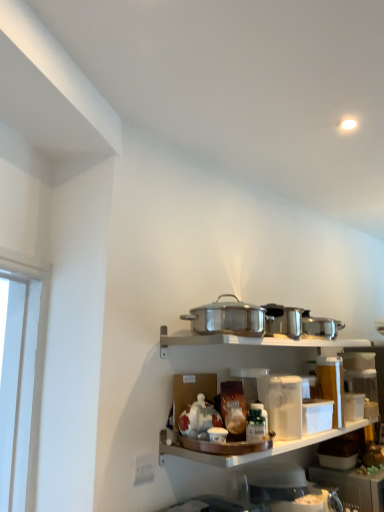
Based on the photo, what is the approximate height of white matte container at center?

white matte container at center is 2.33 inches tall.

Locate an element on the screen. white matte container at center is located at coordinates (246, 452).

You are a GUI agent. You are given a task and a screenshot of the screen. Output one action in this format:
    pyautogui.click(x=<x>, y=<y>)
    Task: Click on the 2nd appliance behind when counting from the white matte container at center
    
    Given the screenshot: What is the action you would take?
    pyautogui.click(x=353, y=487)

Is white plastic container at lower right, placed as the 1th appliance when sorted from back to front, oriented away from white matte container at center?

white plastic container at lower right, placed as the 1th appliance when sorted from back to front, does not have its back to white matte container at center.

Considering the relative sizes of white plastic container at lower right, which is the 1th appliance from bottom to top, and white matte container at center in the image provided, is white plastic container at lower right, which is the 1th appliance from bottom to top, thinner than white matte container at center?

Incorrect, the width of white plastic container at lower right, which is the 1th appliance from bottom to top, is not less than that of white matte container at center.

Is there a large distance between white plastic container at lower right, placed as the 1th appliance when sorted from back to front, and stainless steel pot at center, the first appliance from the top?

No, white plastic container at lower right, placed as the 1th appliance when sorted from back to front, is in close proximity to stainless steel pot at center, the first appliance from the top.

From the image's perspective, is white plastic container at lower right, positioned as the 1th appliance in right-to-left order, located above stainless steel pot at center, positioned as the second appliance in bottom-to-top order?

No, from the image's perspective, white plastic container at lower right, positioned as the 1th appliance in right-to-left order, is not over stainless steel pot at center, positioned as the second appliance in bottom-to-top order.

Who is taller, white plastic container at lower right, which appears as the second appliance when viewed from the top, or stainless steel pot at center, arranged as the first appliance when viewed from the left?

white plastic container at lower right, which appears as the second appliance when viewed from the top, is taller.

Which object is more forward, stainless steel pot at center, positioned as the second appliance in bottom-to-top order, or white plastic container at lower right, placed as the 1th appliance when sorted from back to front?

Positioned in front is stainless steel pot at center, positioned as the second appliance in bottom-to-top order.

Considering the sizes of stainless steel pot at center, the first appliance from the top, and white plastic container at lower right, placed as the 1th appliance when sorted from back to front, in the image, is stainless steel pot at center, the first appliance from the top, bigger or smaller than white plastic container at lower right, placed as the 1th appliance when sorted from back to front,?

stainless steel pot at center, the first appliance from the top, is smaller than white plastic container at lower right, placed as the 1th appliance when sorted from back to front.

Does stainless steel pot at center, arranged as the first appliance when viewed from the left, touch white plastic container at lower right, which is the 1th appliance from bottom to top?

stainless steel pot at center, arranged as the first appliance when viewed from the left, and white plastic container at lower right, which is the 1th appliance from bottom to top, are clearly separated.

Considering the sizes of objects white matte container at center and stainless steel pot at center, arranged as the first appliance when viewed from the left, in the image provided, who is thinner, white matte container at center or stainless steel pot at center, arranged as the first appliance when viewed from the left,?

With smaller width is stainless steel pot at center, arranged as the first appliance when viewed from the left.

How different are the orientations of white matte container at center and stainless steel pot at center, arranged as the second appliance when viewed from the back, in degrees?

There is a 0.435-degree angle between the facing directions of white matte container at center and stainless steel pot at center, arranged as the second appliance when viewed from the back.

Considering the positions of point (282, 449) and point (247, 309), is point (282, 449) closer or farther from the camera than point (247, 309)?

Point (282, 449) is positioned closer to the camera compared to point (247, 309).

Relative to stainless steel pot at center, the second appliance viewed from the right, is white matte container at center in front or behind?

Clearly, white matte container at center is in front of stainless steel pot at center, the second appliance viewed from the right.

This screenshot has width=384, height=512. I want to click on the 1st appliance behind the white matte container at center, so click(x=228, y=318).

Measure the distance from stainless steel pot at center, the first appliance from the top, to white matte container at center.

stainless steel pot at center, the first appliance from the top, and white matte container at center are 43.36 centimeters apart from each other.

Is point (207, 334) positioned behind point (179, 441)?

That is False.

Can you confirm if white matte container at center is positioned to the right of white plastic container at lower right, the 2th appliance positioned from the left?

Incorrect, white matte container at center is not on the right side of white plastic container at lower right, the 2th appliance positioned from the left.

Which is farther, (159,456) or (333,475)?

The point (333,475) is more distant.

Would you say white matte container at center is inside or outside white plastic container at lower right, placed as the 1th appliance when sorted from back to front?

white matte container at center is not inside white plastic container at lower right, placed as the 1th appliance when sorted from back to front, it's outside.

From the image's perspective, is white matte container at center positioned above or below white plastic container at lower right, the 2th appliance positioned from the left?

white matte container at center is situated higher than white plastic container at lower right, the 2th appliance positioned from the left, in the image.

I want to click on shelf positioned vertically above the white plastic container at lower right, which appears as the second appliance when viewed from the top (from a real-world perspective), so click(x=246, y=452).

I want to click on appliance located underneath the stainless steel pot at center, which appears as the first appliance when viewed from the front (from a real-world perspective), so click(353, 487).

Estimate the real-world distances between objects in this image. Which object is further from white matte container at center, stainless steel pot at center, which appears as the first appliance when viewed from the front, or white plastic container at lower right, positioned as the 1th appliance in right-to-left order?

stainless steel pot at center, which appears as the first appliance when viewed from the front, is positioned further to the anchor white matte container at center.

Based on their spatial positions, is white plastic container at lower right, which appears as the second appliance when viewed from the top, or stainless steel pot at center, arranged as the second appliance when viewed from the back, closer to white matte container at center?

Among the two, white plastic container at lower right, which appears as the second appliance when viewed from the top, is located nearer to white matte container at center.

When comparing their distances from stainless steel pot at center, the first appliance from the top, does white matte container at center or white plastic container at lower right, which is the 1th appliance from bottom to top, seem closer?

white matte container at center is positioned closer to the anchor stainless steel pot at center, the first appliance from the top.

Considering their positions, is white plastic container at lower right, placed as the 1th appliance when sorted from back to front, positioned further to stainless steel pot at center, arranged as the first appliance when viewed from the left, than white matte container at center?

white plastic container at lower right, placed as the 1th appliance when sorted from back to front, is positioned further to the anchor stainless steel pot at center, arranged as the first appliance when viewed from the left.

Considering their positions, is stainless steel pot at center, the second appliance viewed from the right, positioned closer to white plastic container at lower right, which is the second appliance in front-to-back order, than white matte container at center?

white matte container at center lies closer to white plastic container at lower right, which is the second appliance in front-to-back order, than the other object.

Looking at the image, which one is located further to white plastic container at lower right, which is the 1th appliance from bottom to top, white matte container at center or stainless steel pot at center, arranged as the second appliance when viewed from the back?

stainless steel pot at center, arranged as the second appliance when viewed from the back, is further to white plastic container at lower right, which is the 1th appliance from bottom to top.

Where is `shelf between stainless steel pot at center, arranged as the first appliance when viewed from the left, and white plastic container at lower right, positioned as the 1th appliance in right-to-left order, from top to bottom`? This screenshot has width=384, height=512. shelf between stainless steel pot at center, arranged as the first appliance when viewed from the left, and white plastic container at lower right, positioned as the 1th appliance in right-to-left order, from top to bottom is located at coordinates (246, 452).